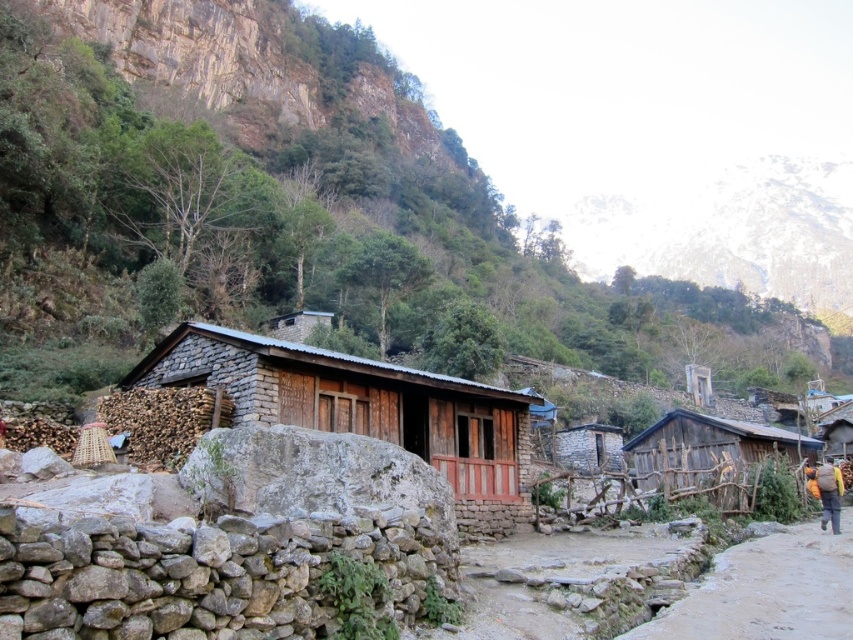
You are an architect designing a new hiking trail that must pass between the rough stone mountain at upper left and the stacked wood next to one of the houses. Based on their positions in the image, which object is closer to the center of the frame?

The rough stone mountain at upper left is located at point (367, 204), which is closer to the center of the frame than the stacked wood next to one of the houses.

You are a hiker who wants to take a photo of the wooden fence at right without the wooden hut at center blocking the view. Which direction should you move to achieve this?

The wooden hut at center is in front of the wooden fence at right, so you should move to the side opposite the wooden hut at center to position yourself where the wooden hut at center no longer blocks the view of the wooden fence at right.